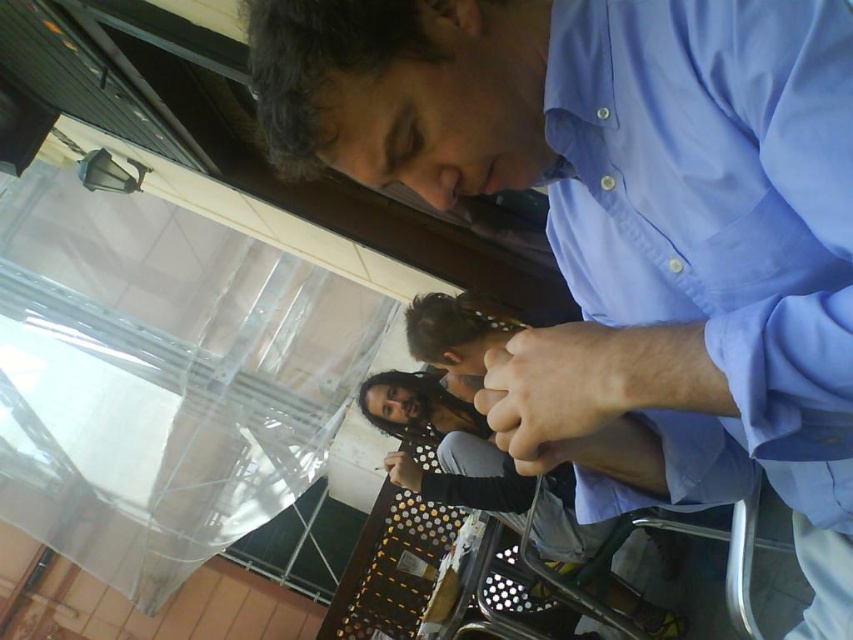
You are a photographer trying to capture a clear shot of both the light blue cotton shirt at center and the smooth skin hand at center. Since the image is slightly tilted, you need to adjust your focus. Which object should you focus on first to ensure both are in frame?

The light blue cotton shirt at center is in front of the smooth skin hand at center, so you should focus on the light blue cotton shirt at center first to ensure both are in frame.

You are a photographer adjusting your camera settings to capture the scene. You want to focus on the smooth skin hand at center and the matte black pen at lower center. Which object should you adjust your focus to first if you want to ensure both are in sharp focus?

The smooth skin hand at center is closer to the viewer than the matte black pen at lower center. To ensure both are in sharp focus, you should focus on the matte black pen at lower center first, as it is farther away. This way, the depth of field will extend from it to the closer hand, maximizing the chances of both being in focus.

You are standing at the point labeled point (535, 390) and want to walk to the point labeled point (399, 476). Which direction should you move relative to the image?

You should move backward relative to the image because point (535, 390) is in front of point (399, 476).